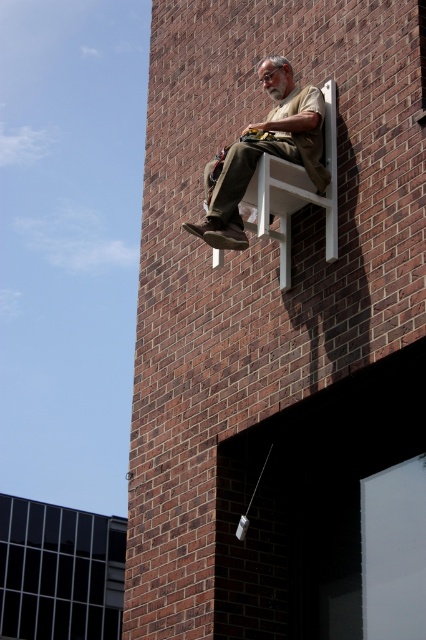
Is clear glass window at lower left positioned at the back of khaki cotton pants at upper center?

Yes, clear glass window at lower left is further from the viewer.

Can you confirm if clear glass window at lower left is positioned below khaki cotton pants at upper center?

Yes, clear glass window at lower left is below khaki cotton pants at upper center.

Describe the element at coordinates (60, 572) in the screenshot. I see `clear glass window at lower left` at that location.

This screenshot has height=640, width=426. Identify the location of clear glass window at lower left. (60, 572).